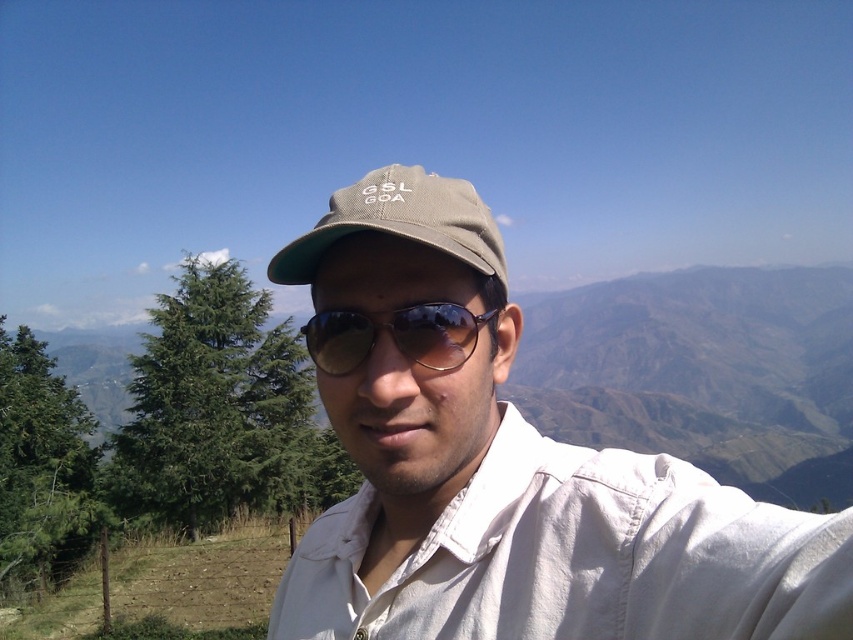
Question: Among these objects, which one is nearest to the camera?

Choices:
 (A) sunglasses at center
 (B) khaki fabric cap at center
 (C) matte khaki cap at center

Answer: (C)

Question: Does matte khaki cap at center appear over khaki fabric cap at center?

Choices:
 (A) no
 (B) yes

Answer: (A)

Question: Considering the real-world distances, which object is closest to the sunglasses at center?

Choices:
 (A) khaki fabric cap at center
 (B) matte khaki cap at center

Answer: (B)

Question: Which point appears closest to the camera in this image?

Choices:
 (A) (390, 220)
 (B) (402, 353)

Answer: (A)

Question: Is matte khaki cap at center wider than sunglasses at center?

Choices:
 (A) yes
 (B) no

Answer: (A)

Question: Considering the relative positions of khaki fabric cap at center and sunglasses at center in the image provided, where is khaki fabric cap at center located with respect to sunglasses at center?

Choices:
 (A) above
 (B) below

Answer: (A)